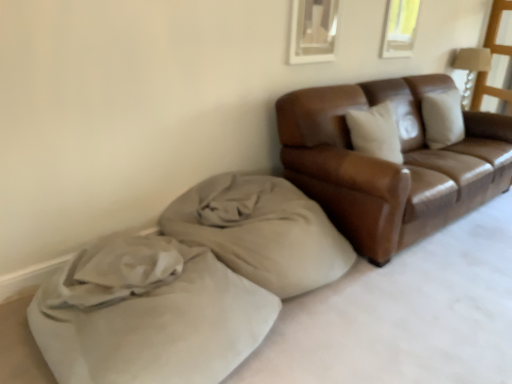
Question: Should I look upward or downward to see beige suede bean bag at lower left?

Choices:
 (A) down
 (B) up

Answer: (A)

Question: Is matte brown wooden lamp at upper right at the right side of beige fabric cushion at lower left?

Choices:
 (A) yes
 (B) no

Answer: (A)

Question: Does matte brown wooden lamp at upper right appear on the left side of beige fabric cushion at lower left?

Choices:
 (A) yes
 (B) no

Answer: (B)

Question: Is matte brown wooden lamp at upper right not within beige fabric cushion at lower left?

Choices:
 (A) yes
 (B) no

Answer: (A)

Question: From the image's perspective, is matte brown wooden lamp at upper right located beneath beige fabric cushion at lower left?

Choices:
 (A) yes
 (B) no

Answer: (B)

Question: Is matte brown wooden lamp at upper right positioned behind beige fabric cushion at lower left?

Choices:
 (A) no
 (B) yes

Answer: (B)

Question: From a real-world perspective, is matte brown wooden lamp at upper right located beneath beige fabric cushion at lower left?

Choices:
 (A) no
 (B) yes

Answer: (A)

Question: Can you confirm if brown leather couch at right is thinner than transparent plastic window screen at upper right?

Choices:
 (A) no
 (B) yes

Answer: (A)

Question: Does brown leather couch at right have a smaller size compared to transparent plastic window screen at upper right?

Choices:
 (A) yes
 (B) no

Answer: (B)

Question: Is the depth of brown leather couch at right less than that of transparent plastic window screen at upper right?

Choices:
 (A) yes
 (B) no

Answer: (A)

Question: Would you consider brown leather couch at right to be distant from transparent plastic window screen at upper right?

Choices:
 (A) yes
 (B) no

Answer: (A)

Question: Is brown leather couch at right positioned behind transparent plastic window screen at upper right?

Choices:
 (A) yes
 (B) no

Answer: (B)

Question: From the image's perspective, is brown leather couch at right beneath transparent plastic window screen at upper right?

Choices:
 (A) yes
 (B) no

Answer: (A)

Question: From the image's perspective, is brown leather couch at right located beneath beige fabric cushion at lower left?

Choices:
 (A) no
 (B) yes

Answer: (A)